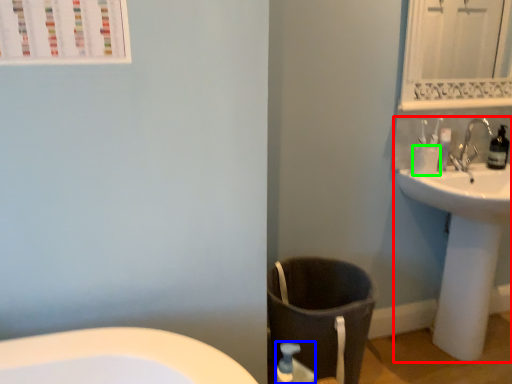
Question: Estimate the real-world distances between objects in this image. Which object is farther from sink (highlighted by a red box), soap dispenser (highlighted by a blue box) or toilet paper (highlighted by a green box)?

Choices:
 (A) soap dispenser
 (B) toilet paper

Answer: (A)